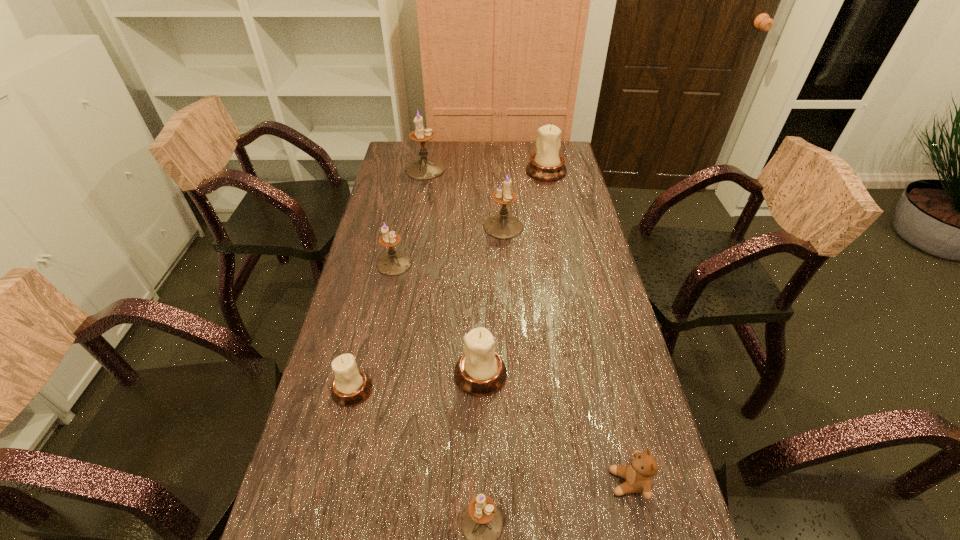
Where is `the farthest purple candle holder`? The height and width of the screenshot is (540, 960). the farthest purple candle holder is located at coordinates (425, 168).

Identify the location of the biggest purple candle holder. The width and height of the screenshot is (960, 540). (425, 168).

Find the location of a particular element. The image size is (960, 540). the biggest white candle holder is located at coordinates (546, 165).

Locate an element on the screen. The height and width of the screenshot is (540, 960). the rightmost white candle holder is located at coordinates (546, 165).

Identify the location of the third farthest candle holder. (502, 226).

Locate an element on the screen. Image resolution: width=960 pixels, height=540 pixels. the second biggest purple candle holder is located at coordinates (502, 226).

You are a GUI agent. You are given a task and a screenshot of the screen. Output one action in this format:
    pyautogui.click(x=<x>, y=<y>)
    Task: Click on the second white candle holder from right to left
    This screenshot has height=540, width=960.
    Given the screenshot: What is the action you would take?
    pyautogui.click(x=480, y=371)

This screenshot has height=540, width=960. In order to click on the fourth nearest candle holder in this screenshot , I will do `click(393, 263)`.

You are a GUI agent. You are given a task and a screenshot of the screen. Output one action in this format:
    pyautogui.click(x=<x>, y=<y>)
    Task: Click on the fourth farthest object
    This screenshot has width=960, height=540.
    Given the screenshot: What is the action you would take?
    pyautogui.click(x=393, y=263)

In order to click on the leftmost white candle holder in this screenshot , I will do `click(351, 386)`.